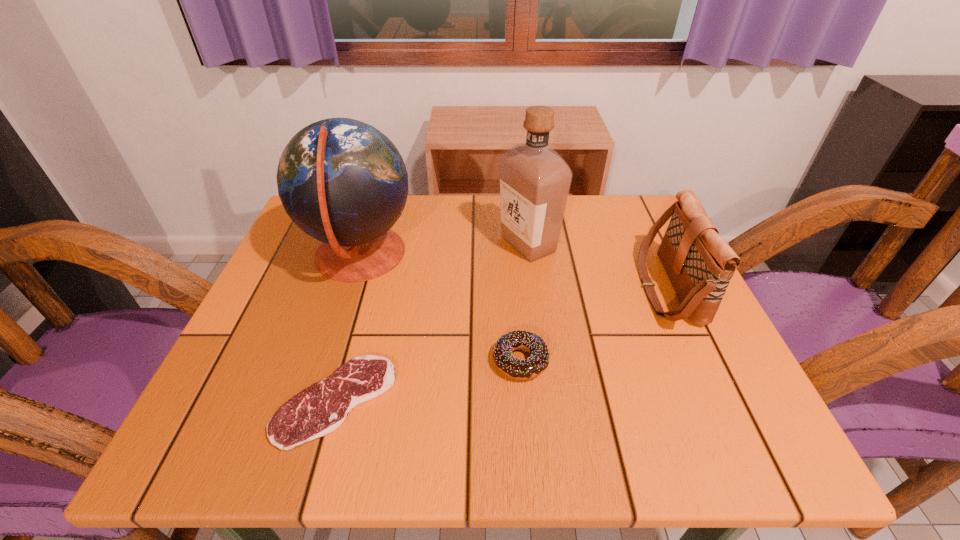
Find the location of a particular element. the closest object to the liquor is located at coordinates (699, 263).

Image resolution: width=960 pixels, height=540 pixels. In order to click on object that is the fourth closest to the liquor in this screenshot , I will do `click(320, 409)`.

You are a GUI agent. You are given a task and a screenshot of the screen. Output one action in this format:
    pyautogui.click(x=<x>, y=<y>)
    Task: Click on the vacant space that satisfies the following two spatial constraints: 1. with the Americas facing the viewer on the globe; 2. on the back side of the shortest object
    This screenshot has width=960, height=540.
    Given the screenshot: What is the action you would take?
    click(313, 401)

The image size is (960, 540). In order to click on free space that satisfies the following two spatial constraints: 1. with the Americas facing the viewer on the shortest object; 2. on the left side of the globe in this screenshot , I will do `click(313, 401)`.

The width and height of the screenshot is (960, 540). What are the coordinates of `free space that satisfies the following two spatial constraints: 1. on the front-facing side of the liquor; 2. on the front side of the shortest object` in the screenshot? It's located at (549, 401).

This screenshot has height=540, width=960. I want to click on vacant region that satisfies the following two spatial constraints: 1. on the back side of the doughnut; 2. on the right side of the steak, so click(347, 361).

The image size is (960, 540). Find the location of `vacant space that satisfies the following two spatial constraints: 1. with the Americas facing the viewer on the shortest object; 2. on the right side of the globe`. vacant space that satisfies the following two spatial constraints: 1. with the Americas facing the viewer on the shortest object; 2. on the right side of the globe is located at coordinates point(313,401).